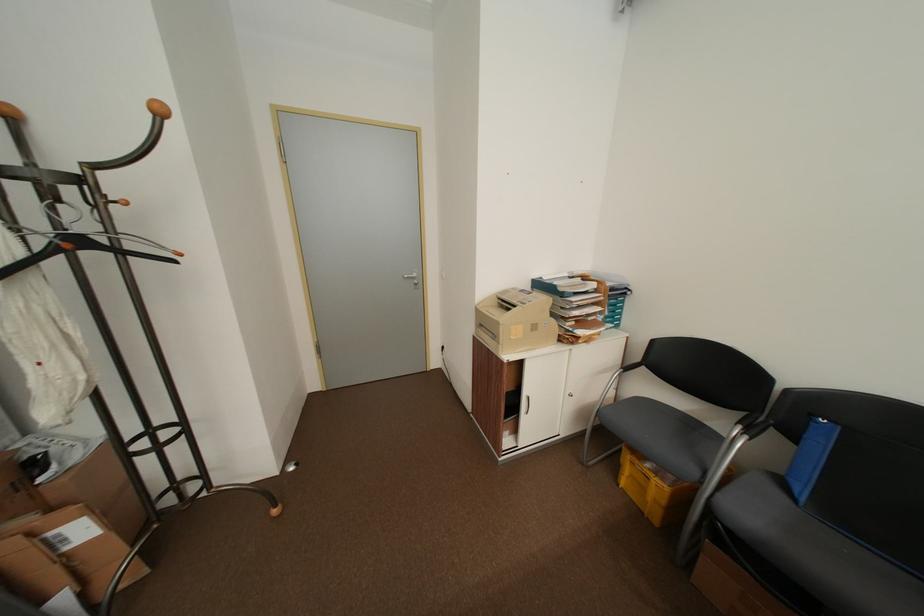
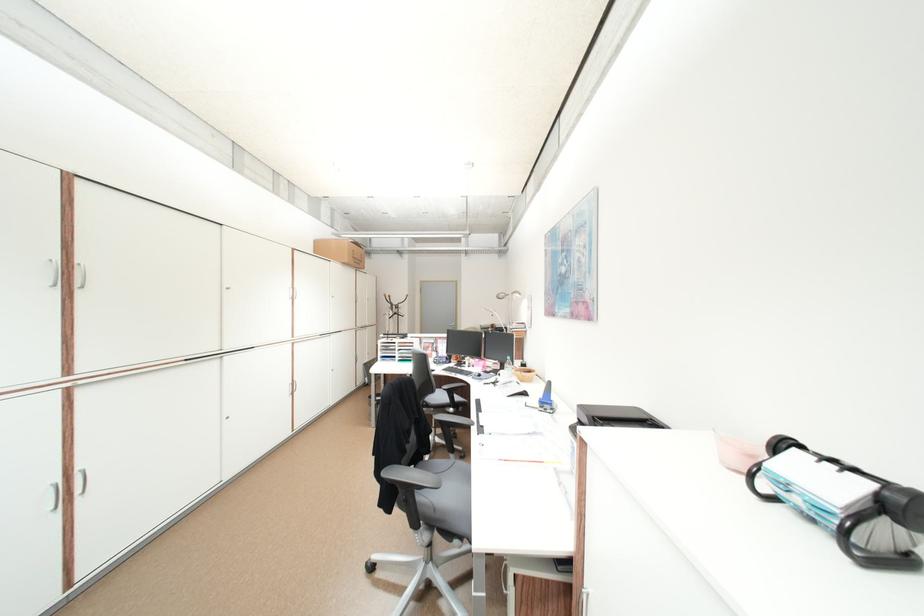
Question: I am providing you with two images of the same scene from different viewpoints. Please identify which objects are invisible in image2.

Choices:
 (A) printer lid
 (B) card file knob
 (C) orange
 (D) gray chair sitting surface

Answer: (D)